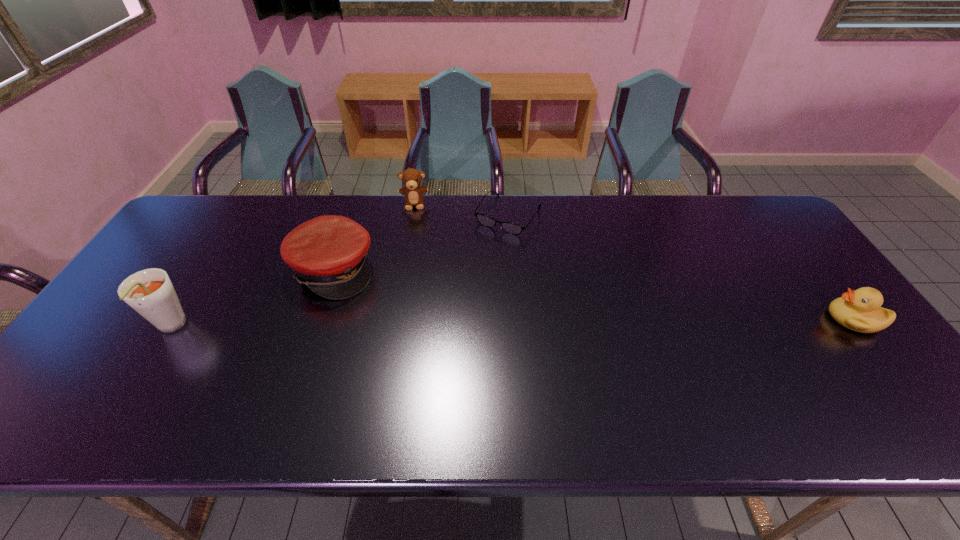
Find the location of a particular element. The width and height of the screenshot is (960, 540). vacant spot on the desktop that is between the tallest object and the rightmost object and is positioned on the front of the cap with an emblem is located at coordinates (447, 325).

I want to click on free space on the desktop that is between the leftmost object and the rightmost object and is positioned on the front-facing side of the shortest object, so click(431, 325).

You are a GUI agent. You are given a task and a screenshot of the screen. Output one action in this format:
    pyautogui.click(x=<x>, y=<y>)
    Task: Click on the free space on the desktop that is between the root beer and the rightmost object and is positioned on the face of the teddy bear
    
    Given the screenshot: What is the action you would take?
    pyautogui.click(x=413, y=325)